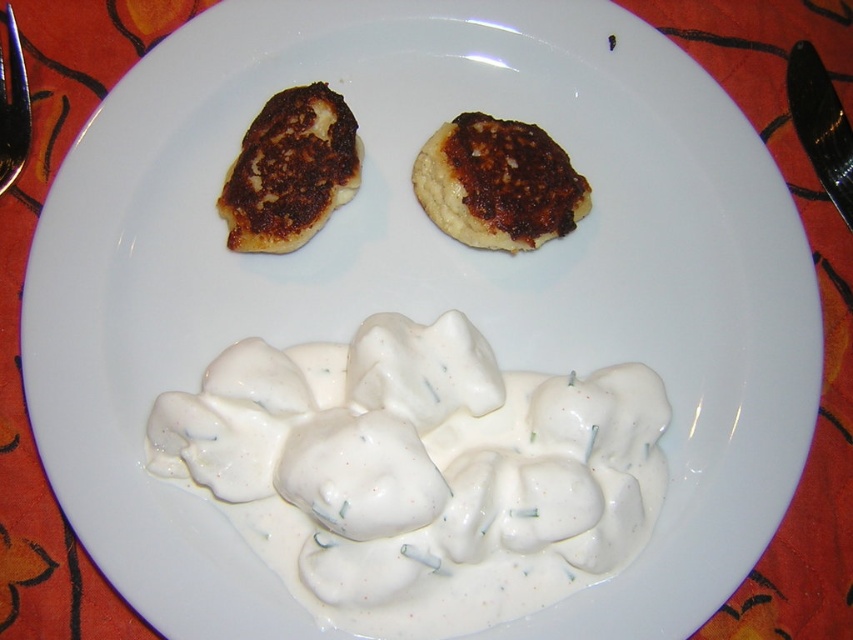
Question: Is brown crispy pancake at upper center smaller than metallic silver fork at upper left?

Choices:
 (A) no
 (B) yes

Answer: (A)

Question: Which point is farther to the camera?

Choices:
 (A) (10, 68)
 (B) (268, 250)
 (C) (268, 502)
 (D) (489, 209)

Answer: (A)

Question: Is brown crispy pancake at upper center wider than brown crispy pancake at upper left?

Choices:
 (A) yes
 (B) no

Answer: (A)

Question: Can you confirm if brown crispy pancake at upper left is positioned to the right of metallic silver fork at upper left?

Choices:
 (A) no
 (B) yes

Answer: (B)

Question: Which point is farther from the camera taking this photo?

Choices:
 (A) (486, 230)
 (B) (9, 42)
 (C) (283, 193)

Answer: (A)

Question: Which object appears farthest from the camera in this image?

Choices:
 (A) brown crispy pancake at upper left
 (B) metallic silver fork at upper left
 (C) white creamy sauce at center
 (D) brown crispy pancake at upper center

Answer: (D)